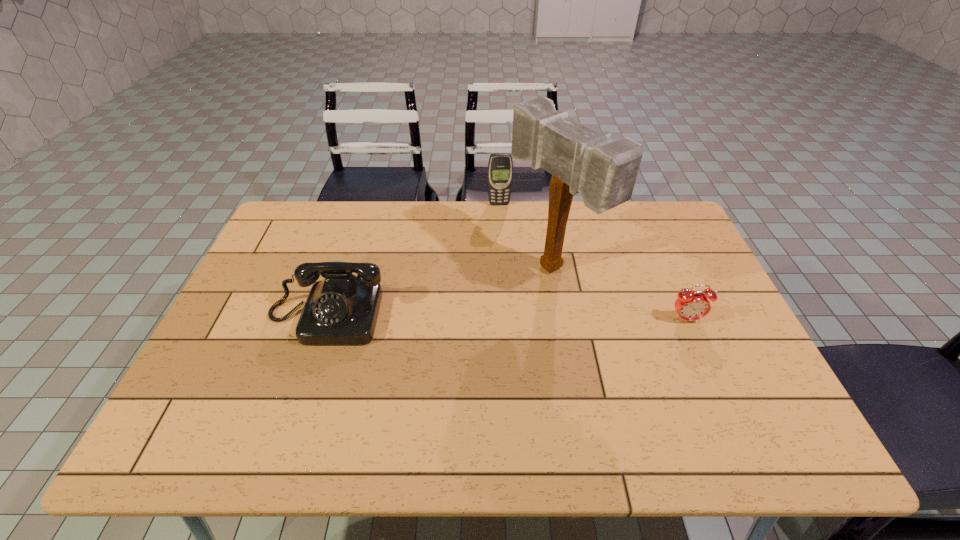
Identify the location of vacant area situated on the screen of the farthest object. This screenshot has width=960, height=540. (509, 269).

This screenshot has width=960, height=540. What are the coordinates of `vacant area situated at the head of the mallet` in the screenshot? It's located at (434, 336).

You are a GUI agent. You are given a task and a screenshot of the screen. Output one action in this format:
    pyautogui.click(x=<x>, y=<y>)
    Task: Click on the vacant space situated at the head of the mallet
    Image resolution: width=960 pixels, height=540 pixels.
    Given the screenshot: What is the action you would take?
    pyautogui.click(x=441, y=332)

Locate an element on the screen. free location located at the head of the mallet is located at coordinates (484, 309).

The width and height of the screenshot is (960, 540). What are the coordinates of `cellular telephone present at the far edge` in the screenshot? It's located at 500,166.

The width and height of the screenshot is (960, 540). I want to click on mallet positioned at the far edge, so click(604, 171).

At what (x,y) coordinates should I click in order to perform the action: click on object at the left edge. Please return your answer as a coordinate pair (x, y). Looking at the image, I should click on (342, 309).

You are a GUI agent. You are given a task and a screenshot of the screen. Output one action in this format:
    pyautogui.click(x=<x>, y=<y>)
    Task: Click on the object situated at the right edge
    The image size is (960, 540).
    Given the screenshot: What is the action you would take?
    pyautogui.click(x=690, y=306)

You are a GUI agent. You are given a task and a screenshot of the screen. Output one action in this format:
    pyautogui.click(x=<x>, y=<y>)
    Task: Click on the vacant space at the far edge of the desktop
    
    Given the screenshot: What is the action you would take?
    pyautogui.click(x=622, y=235)

Locate an element on the screen. The height and width of the screenshot is (540, 960). vacant region at the near edge of the desktop is located at coordinates (583, 405).